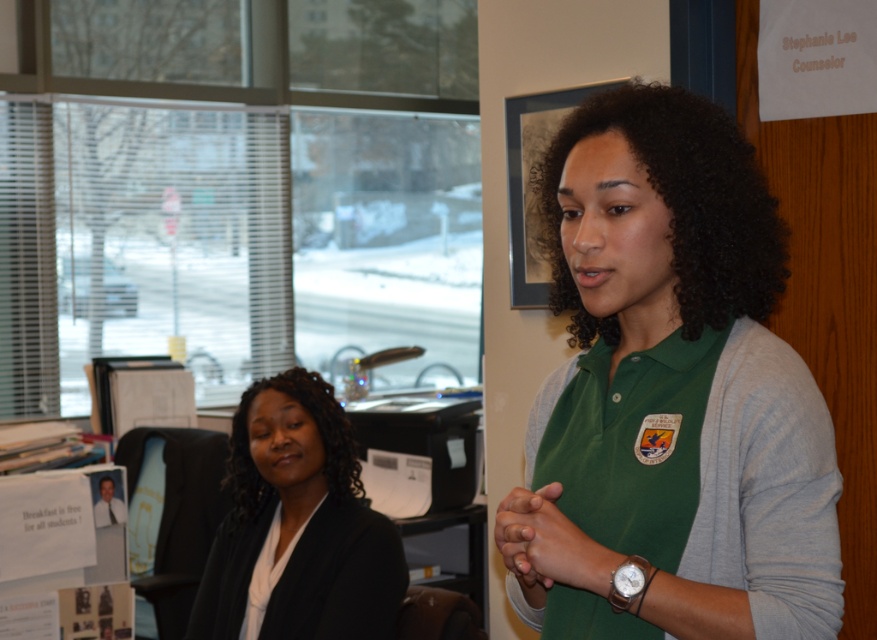
Question: Does black matte blazer at left appear on the left side of green matte afro at center?

Choices:
 (A) no
 (B) yes

Answer: (B)

Question: In this image, where is black silky hair at center located relative to silver metallic watch at lower right?

Choices:
 (A) left
 (B) right

Answer: (A)

Question: Which of the following is the farthest from the observer?

Choices:
 (A) (237, 464)
 (B) (699, 147)
 (C) (300, 534)

Answer: (A)

Question: Which point appears closest to the camera in this image?

Choices:
 (A) (604, 196)
 (B) (236, 412)

Answer: (A)

Question: In this image, where is green matte afro at center located relative to green matte hands at center?

Choices:
 (A) right
 (B) left

Answer: (A)

Question: Which of these objects is positioned farthest from the black silky hair at center?

Choices:
 (A) black matte blazer at left
 (B) green matte hands at center
 (C) green fabric shirt at center
 (D) silver metallic watch at lower right

Answer: (D)